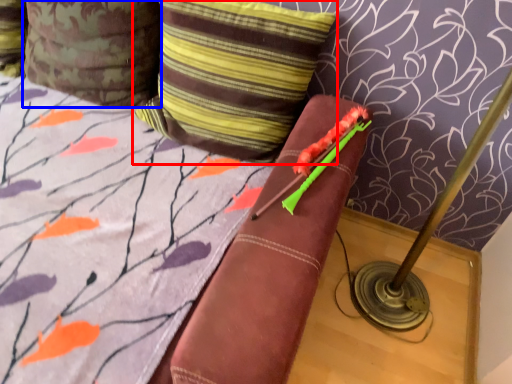
Question: Which object appears closest to the camera in this image, pillow (highlighted by a red box) or pillow (highlighted by a blue box)?

Choices:
 (A) pillow
 (B) pillow

Answer: (A)